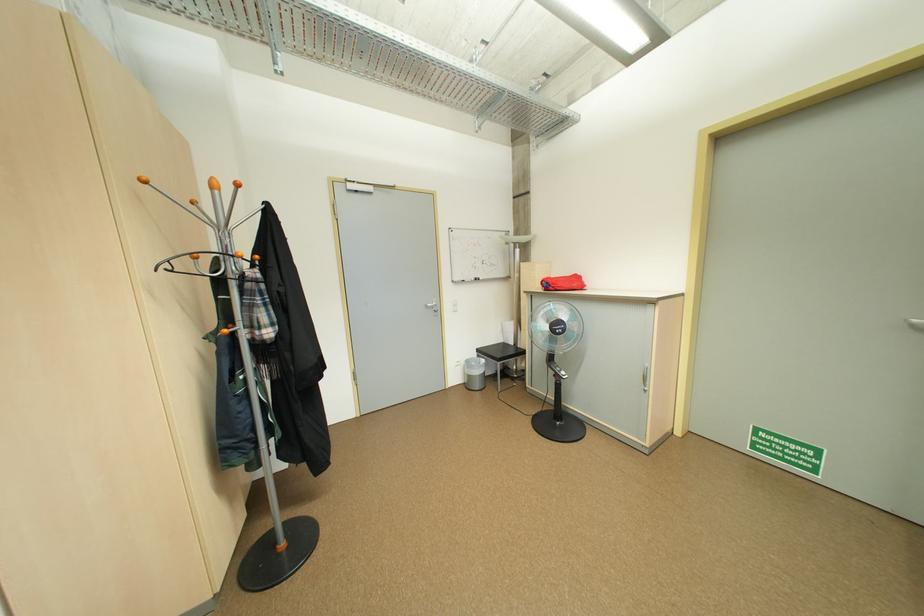
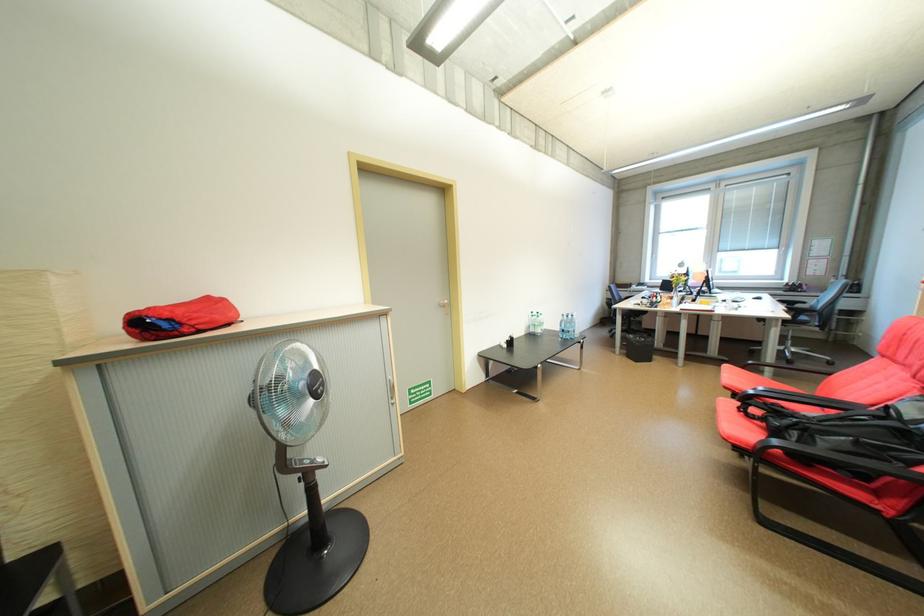
Locate, in the second image, the point that corresponds to (x=560, y=289) in the first image.

(196, 331)